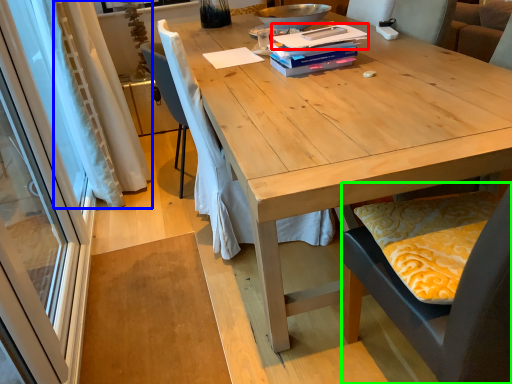
Question: Which object is the closest to the paperback book (highlighted by a red box)? Choose among these: curtain (highlighted by a blue box) or chair (highlighted by a green box).

Choices:
 (A) curtain
 (B) chair

Answer: (B)